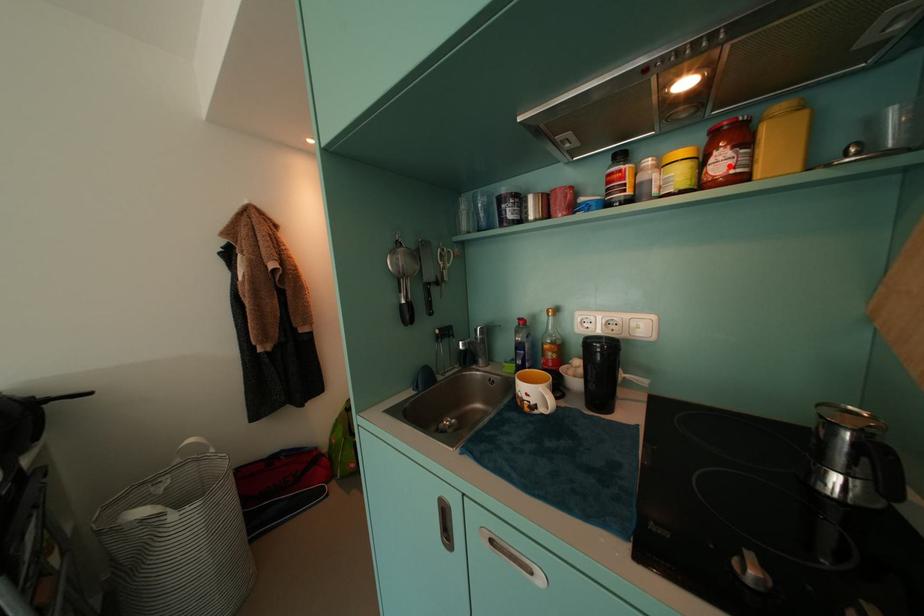
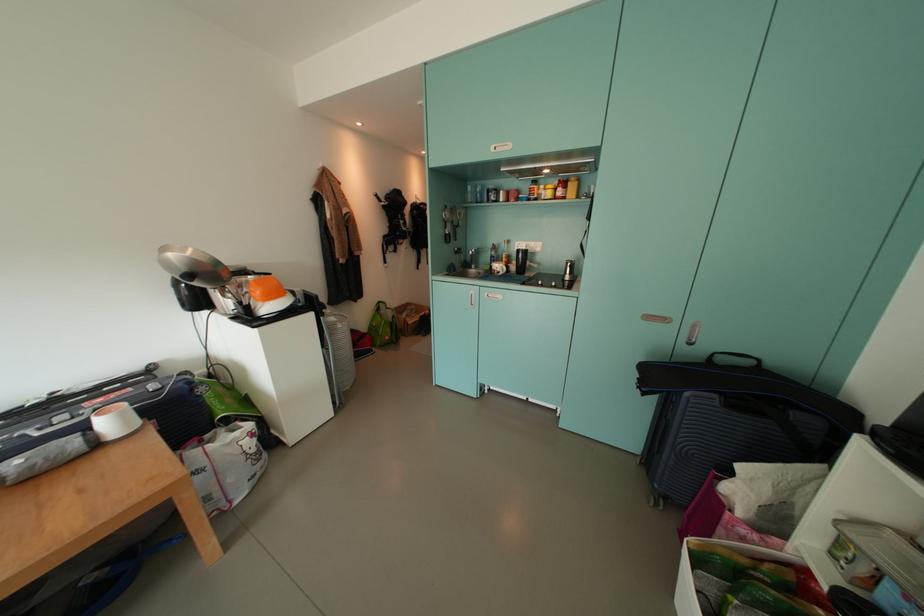
Where in the second image is the point corresponding to the highlighted location from the first image?

(566, 195)